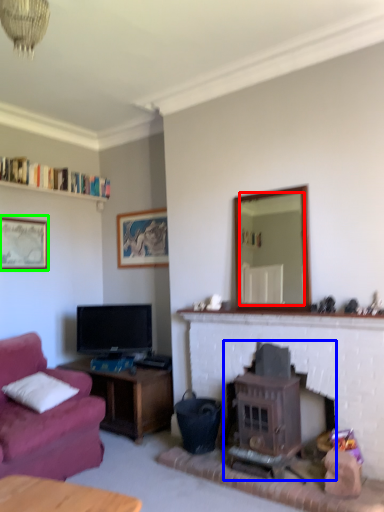
Question: Which object is positioned closest to mirror (highlighted by a red box)? Select from wood burning stove (highlighted by a blue box) and picture frame (highlighted by a green box).

Choices:
 (A) wood burning stove
 (B) picture frame

Answer: (B)